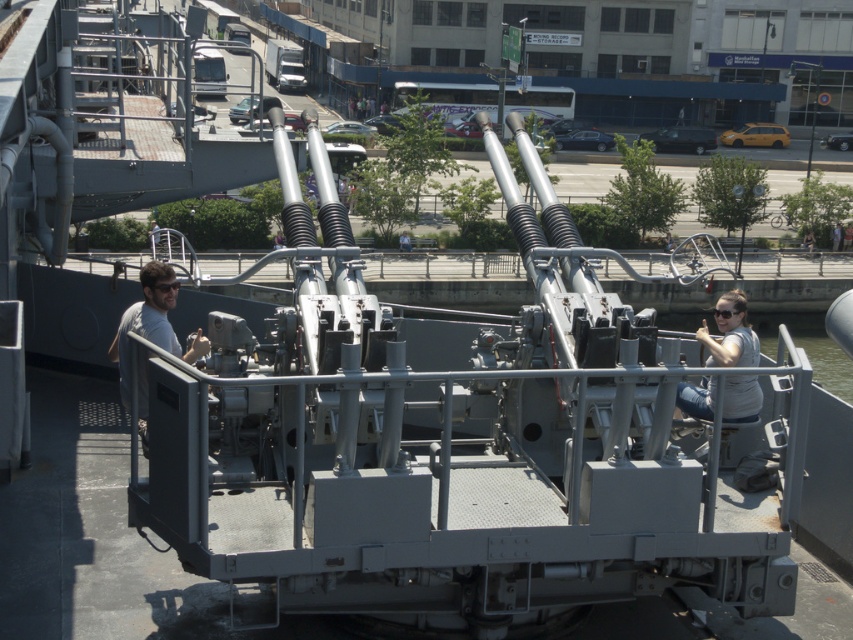
Question: Can you confirm if gray metallic gun turret at center is positioned above gray matte shirt at left?

Choices:
 (A) yes
 (B) no

Answer: (A)

Question: Which point is closer to the camera taking this photo?

Choices:
 (A) (276, 525)
 (B) (697, 388)

Answer: (A)

Question: Which point is closer to the camera?

Choices:
 (A) (239, 476)
 (B) (148, 333)
 (C) (724, 396)

Answer: (A)

Question: Among these points, which one is nearest to the camera?

Choices:
 (A) (682, 392)
 (B) (546, 413)
 (C) (144, 317)

Answer: (C)

Question: Can you confirm if gray metallic gun turret at center is positioned to the right of gray fabric shirt at center?

Choices:
 (A) yes
 (B) no

Answer: (B)

Question: In this image, where is gray fabric shirt at center located relative to gray matte shirt at left?

Choices:
 (A) below
 (B) above

Answer: (B)